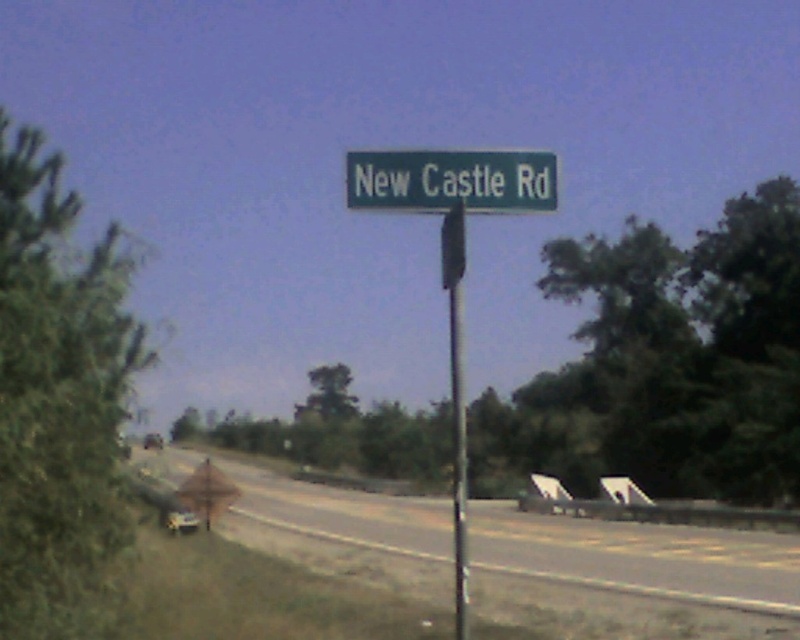
You are standing at the point marked by the coordinates point (x=641, y=557) in the image. What type of surface are you currently standing on?

The point (x=641, y=557) indicates gray asphalt highway at center, so you are standing on gray asphalt highway at center.

You are driving a car and see two points on the road ahead. The first point is at coordinates point [513,157] and the second point is at point [458,577]. Which point is closer to your current position?

Point [458,577] is closer to your current position because point [513,157] is behind it.

You are driving a car and see the metallic pole at center and the metallic silver car at lower left in your view. Which object is positioned more to the right from your perspective?

The metallic pole at center is positioned more to the right than the metallic silver car at lower left.